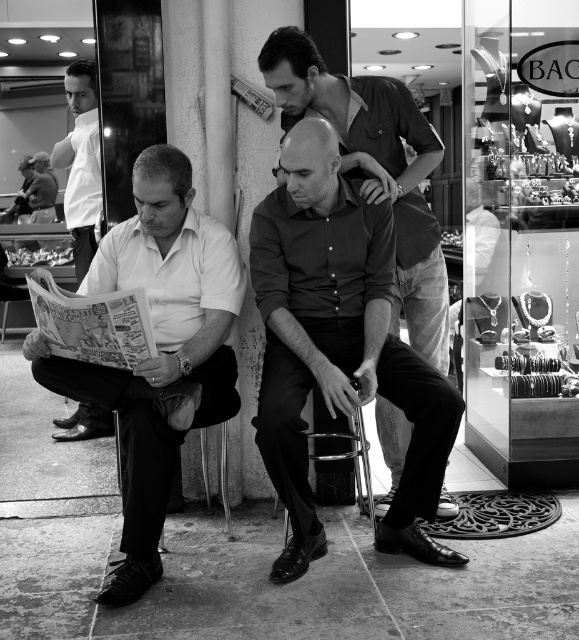
Which is behind, point (428, 417) or point (85, 166)?

Point (85, 166)

Is smooth black shirt at center thinner than white shirt at left?

Incorrect, smooth black shirt at center's width is not less than white shirt at left's.

Which is behind, point (369, 362) or point (85, 81)?

Positioned behind is point (85, 81).

Where is `smooth black shirt at center`? smooth black shirt at center is located at coordinates (338, 346).

Which is more to the right, white shirt at left or metallic silver chair at center?

Positioned to the right is metallic silver chair at center.

Is white shirt at left wider than metallic silver chair at center?

Incorrect, white shirt at left's width does not surpass metallic silver chair at center's.

Between point (86, 179) and point (368, 496), which one is positioned in front?

Point (368, 496) is more forward.

Image resolution: width=579 pixels, height=640 pixels. What are the coordinates of `white shirt at left` in the screenshot? It's located at (80, 163).

Is smooth black shirt at center smaller than matte white shirt at left?

Indeed, smooth black shirt at center has a smaller size compared to matte white shirt at left.

Is smooth black shirt at center to the right of matte white shirt at left from the viewer's perspective?

Indeed, smooth black shirt at center is positioned on the right side of matte white shirt at left.

Where is `smooth black shirt at center`? The width and height of the screenshot is (579, 640). smooth black shirt at center is located at coordinates (338, 346).